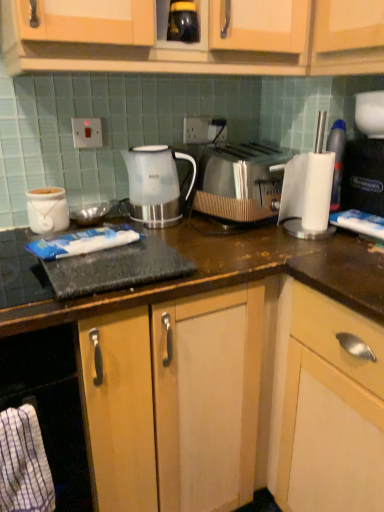
Question: Is white plastic switch at upper center, the 2th electric outlet positioned from the right, positioned in front of white plastic cup at right?

Choices:
 (A) no
 (B) yes

Answer: (A)

Question: From the image's perspective, does white plastic switch at upper center, marked as the 2th electric outlet in a back-to-front arrangement, appear lower than white plastic cup at right?

Choices:
 (A) no
 (B) yes

Answer: (A)

Question: Is there a large distance between white plastic switch at upper center, the first electric outlet positioned from the left, and white plastic cup at right?

Choices:
 (A) no
 (B) yes

Answer: (A)

Question: Does white plastic switch at upper center, marked as the 2th electric outlet in a back-to-front arrangement, have a greater width compared to white plastic cup at right?

Choices:
 (A) no
 (B) yes

Answer: (A)

Question: Is white plastic switch at upper center, which is counted as the first electric outlet, starting from the front, at the left side of white plastic cup at right?

Choices:
 (A) no
 (B) yes

Answer: (B)

Question: Considering the positions of white plastic switch at upper center, marked as the 2th electric outlet in a back-to-front arrangement, and white glossy jar at left in the image, is white plastic switch at upper center, marked as the 2th electric outlet in a back-to-front arrangement, wider or thinner than white glossy jar at left?

Choices:
 (A) thin
 (B) wide

Answer: (A)

Question: Is point (79, 135) closer or farther from the camera than point (41, 198)?

Choices:
 (A) farther
 (B) closer

Answer: (A)

Question: Is white plastic switch at upper center, marked as the 2th electric outlet in a back-to-front arrangement, taller or shorter than white glossy jar at left?

Choices:
 (A) tall
 (B) short

Answer: (B)

Question: Based on their positions, is white plastic switch at upper center, which is counted as the first electric outlet, starting from the front, located to the left or right of white glossy jar at left?

Choices:
 (A) right
 (B) left

Answer: (A)

Question: In terms of size, does black plastic coffee machine at right appear bigger or smaller than translucent plastic kettle at center?

Choices:
 (A) big
 (B) small

Answer: (B)

Question: Which is correct: black plastic coffee machine at right is inside translucent plastic kettle at center, or outside of it?

Choices:
 (A) inside
 (B) outside

Answer: (B)

Question: From the image's perspective, is black plastic coffee machine at right above or below translucent plastic kettle at center?

Choices:
 (A) below
 (B) above

Answer: (B)

Question: Would you say black plastic coffee machine at right is to the left or to the right of translucent plastic kettle at center in the picture?

Choices:
 (A) left
 (B) right

Answer: (B)

Question: Visually, is white glossy jar at left positioned to the left or to the right of white plastic electric outlet at upper center, which ranks as the 1th electric outlet in back-to-front order?

Choices:
 (A) left
 (B) right

Answer: (A)

Question: Is white glossy jar at left spatially inside white plastic electric outlet at upper center, positioned as the 1th electric outlet in right-to-left order, or outside of it?

Choices:
 (A) inside
 (B) outside

Answer: (B)